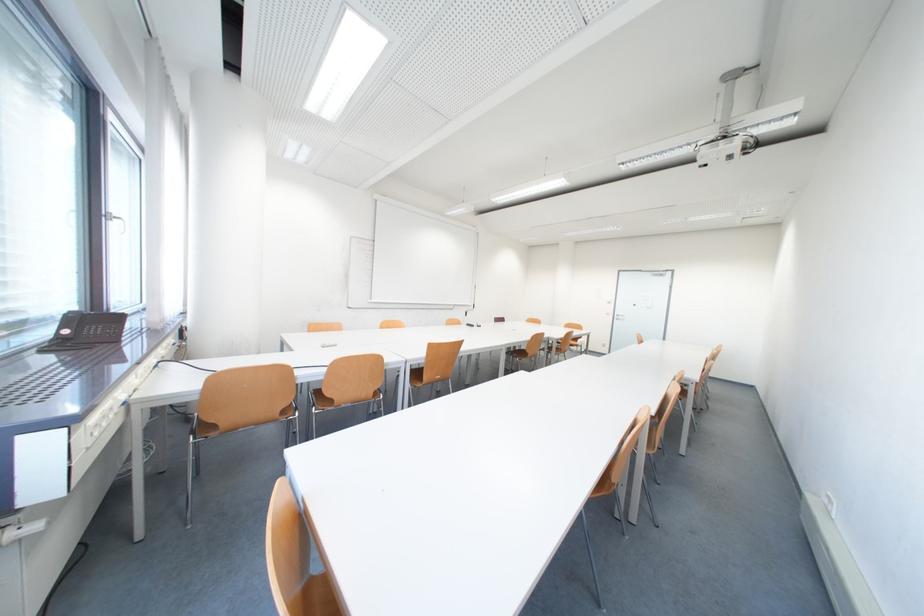
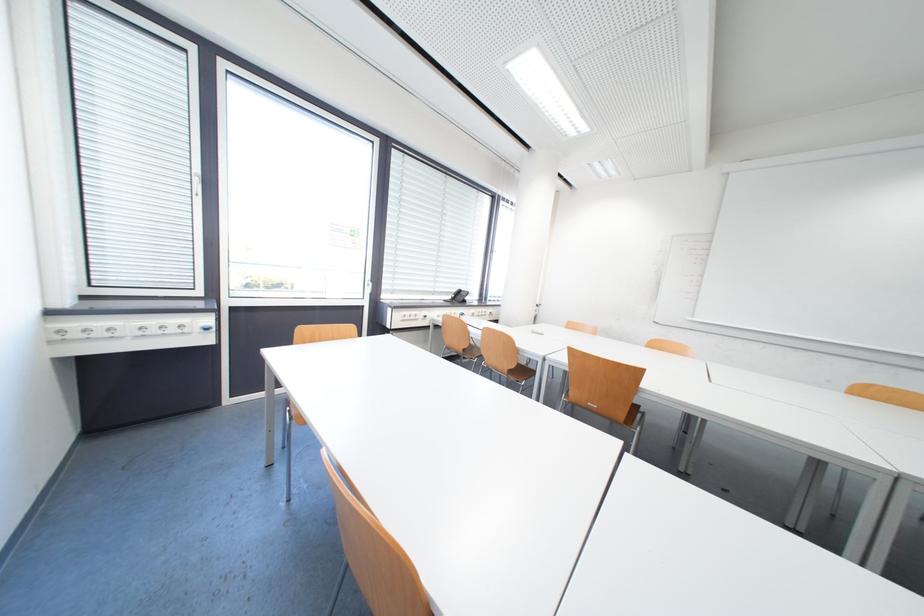
The point at (x=287, y=416) is marked in the first image. Where is the corresponding point in the second image?

(471, 352)